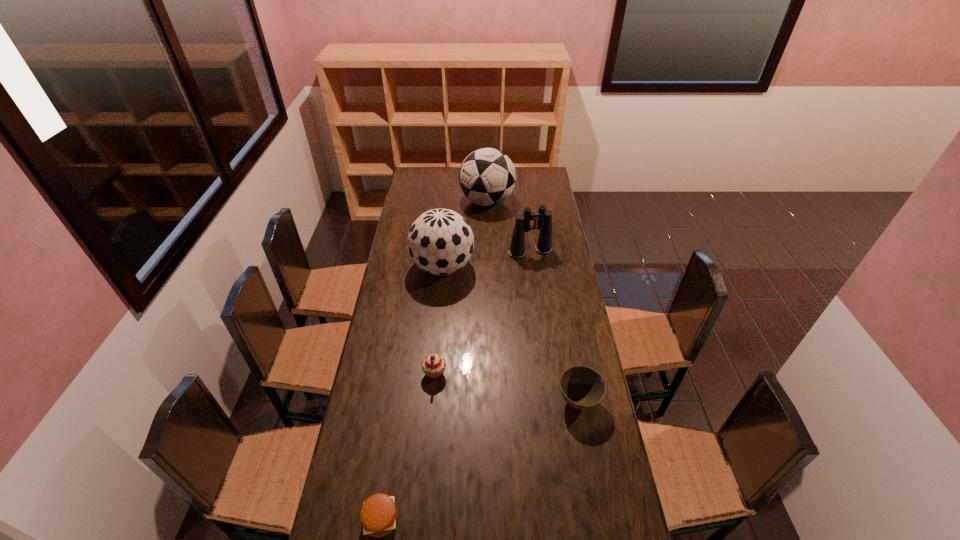
The width and height of the screenshot is (960, 540). What are the coordinates of `the farthest object` in the screenshot? It's located at (487, 176).

The width and height of the screenshot is (960, 540). What are the coordinates of `the nearer soccer ball` in the screenshot? It's located at (440, 241).

This screenshot has height=540, width=960. What are the coordinates of `the fourth shortest object` in the screenshot? It's located at (544, 217).

This screenshot has height=540, width=960. Find the location of `cupcake`. cupcake is located at coordinates (433, 366).

The image size is (960, 540). Find the location of `the fifth tallest object`. the fifth tallest object is located at coordinates (582, 387).

Locate an element on the screen. The width and height of the screenshot is (960, 540). the shortest object is located at coordinates (378, 514).

Where is `hamburger`? hamburger is located at coordinates (378, 514).

Find the location of `free location located on the surface of the farther soccer ball where the brand logo is visible`. free location located on the surface of the farther soccer ball where the brand logo is visible is located at coordinates (425, 201).

Identify the location of free spot located on the surface of the farther soccer ball where the brand logo is visible. The height and width of the screenshot is (540, 960). (432, 201).

Locate an element on the screen. This screenshot has height=540, width=960. vacant space located on the surface of the farther soccer ball where the brand logo is visible is located at coordinates tap(445, 201).